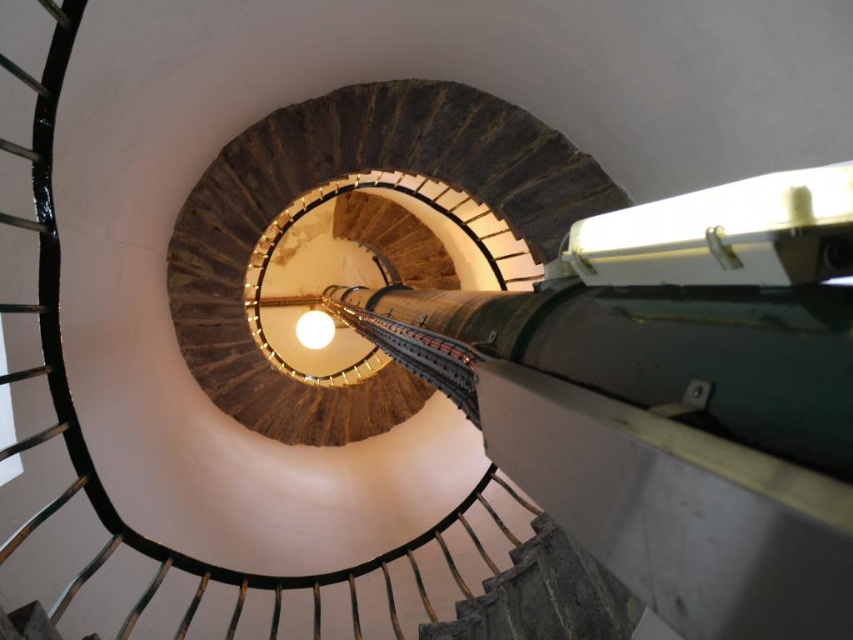
Between wooden stairs at center and stone textured stairs at center, which one is positioned higher?

wooden stairs at center is higher up.

Does wooden stairs at center have a greater height compared to stone textured stairs at center?

Correct, wooden stairs at center is much taller as stone textured stairs at center.

Is point (550, 228) farther from camera compared to point (561, 541)?

Yes, it is behind point (561, 541).

Find the location of a particular element. This screenshot has width=853, height=640. wooden stairs at center is located at coordinates (338, 177).